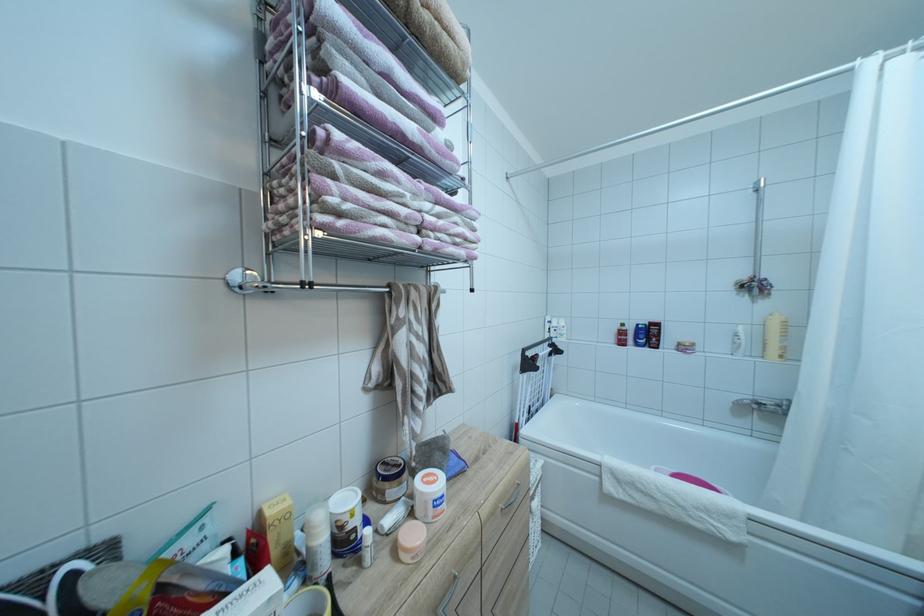
Image resolution: width=924 pixels, height=616 pixels. What do you see at coordinates (775, 407) in the screenshot? I see `the bathtub faucet handle` at bounding box center [775, 407].